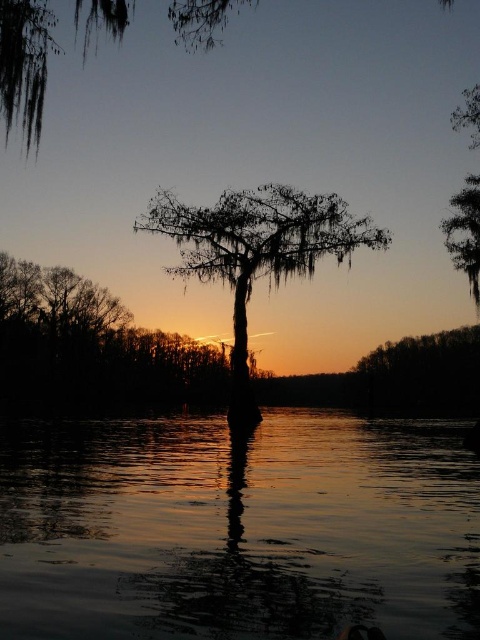
You are an artist trying to paint the sunset scene. You need to place the silvery bark tree at center and the silhouette mossy cypress tree at center in your painting. According to the scene, which tree should you draw to the left side?

The silvery bark tree at center should be drawn to the left side of the silhouette mossy cypress tree at center because the description states that it is positioned on the left side of it.

You are a photographer positioned at the center of the image. You want to capture the silvery bark tree at center in your shot. Based on its coordinates, is the tree closer to the top or bottom of the image?

The silvery bark tree at center is located at coordinates point (94,344). Since the y coordinate is 0.196, which is closer to 0 than 1, the tree is closer to the bottom of the image.